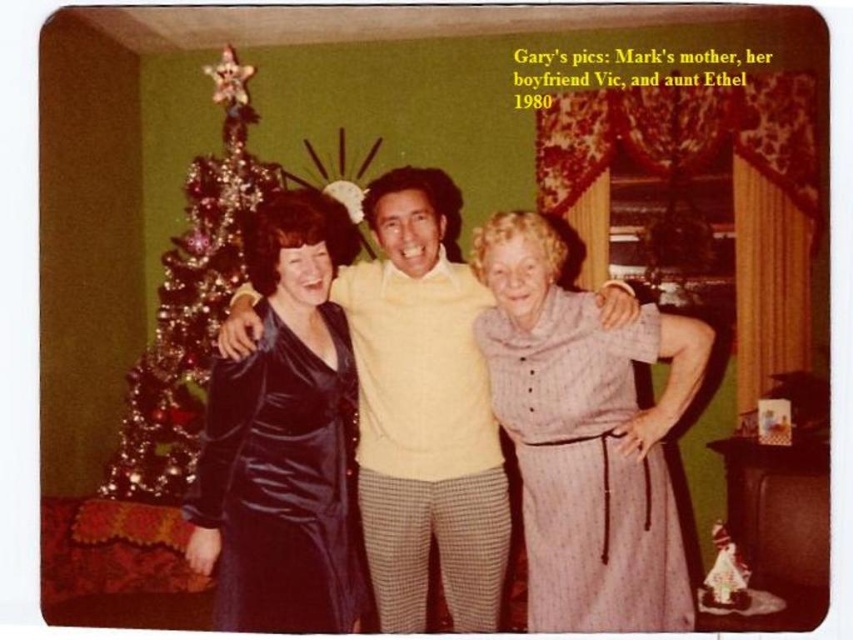
Question: Can you confirm if striped fabric dress at center is positioned to the left of shiny purple dress at center?

Choices:
 (A) no
 (B) yes

Answer: (A)

Question: Which point is farther to the camera?

Choices:
 (A) (335, 506)
 (B) (187, 336)

Answer: (B)

Question: Which object appears farthest from the camera in this image?

Choices:
 (A) satin dress at center
 (B) shiny metallic tree at left

Answer: (B)

Question: Does satin dress at center appear on the right side of shiny purple dress at center?

Choices:
 (A) yes
 (B) no

Answer: (A)

Question: Is striped fabric dress at center smaller than shiny metallic tree at left?

Choices:
 (A) no
 (B) yes

Answer: (B)

Question: Which object is closer to the camera taking this photo?

Choices:
 (A) striped fabric dress at center
 (B) satin dress at center
 (C) shiny metallic tree at left
 (D) shiny purple dress at center

Answer: (D)